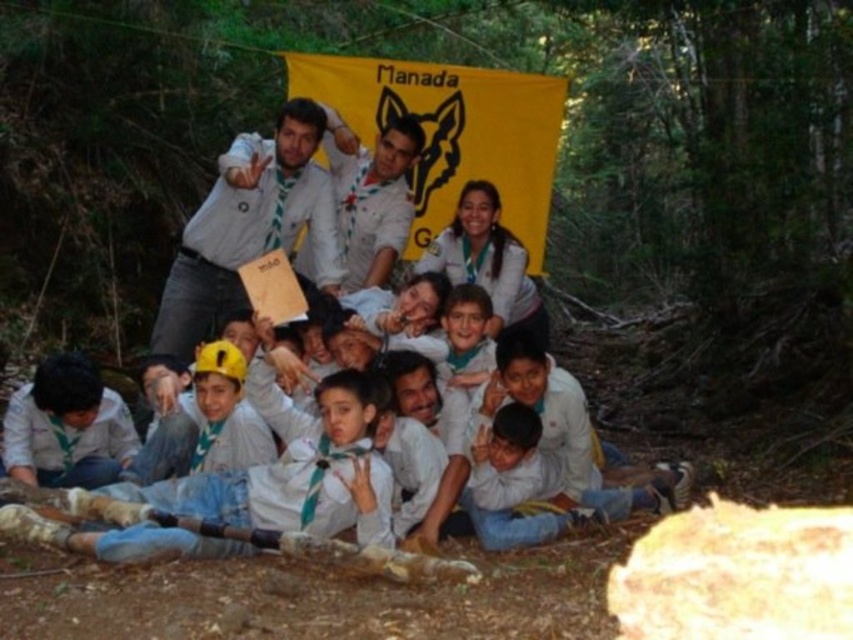
Locate an element on the screen. The image size is (853, 640). matte white shirt at center is located at coordinates (248, 225).

Identify the location of matte white shirt at center. (248, 225).

Looking at this image, is white cotton shirt at center positioned behind white fabric shirt at center?

No, it is in front of white fabric shirt at center.

Based on the photo, does white cotton shirt at center have a smaller size compared to white fabric shirt at center?

Actually, white cotton shirt at center might be larger than white fabric shirt at center.

Find the location of `white cotton shirt at center`. white cotton shirt at center is located at coordinates (297, 477).

Describe the element at coordinates (297, 477) in the screenshot. I see `white cotton shirt at center` at that location.

Between white cotton shirt at center and matte white shirt at center, which one has more height?

With more height is matte white shirt at center.

The height and width of the screenshot is (640, 853). What are the coordinates of `white cotton shirt at center` in the screenshot? It's located at (297, 477).

This screenshot has width=853, height=640. I want to click on white cotton shirt at center, so click(x=297, y=477).